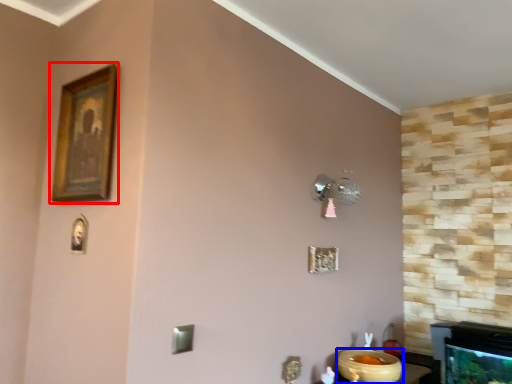
Question: Among these objects, which one is farthest to the camera, picture frame (highlighted by a red box) or glass bowl (highlighted by a blue box)?

Choices:
 (A) picture frame
 (B) glass bowl

Answer: (B)